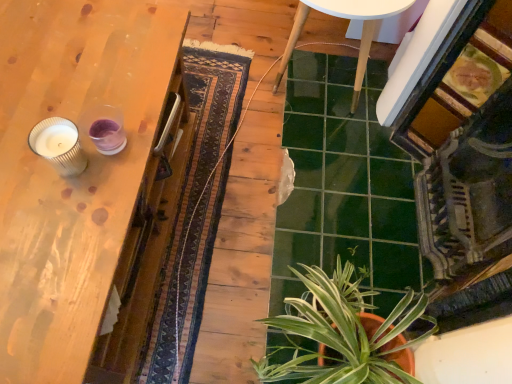
Find the location of `free space above wooden table at left (from a real-world perspective)`. free space above wooden table at left (from a real-world perspective) is located at coordinates (69, 118).